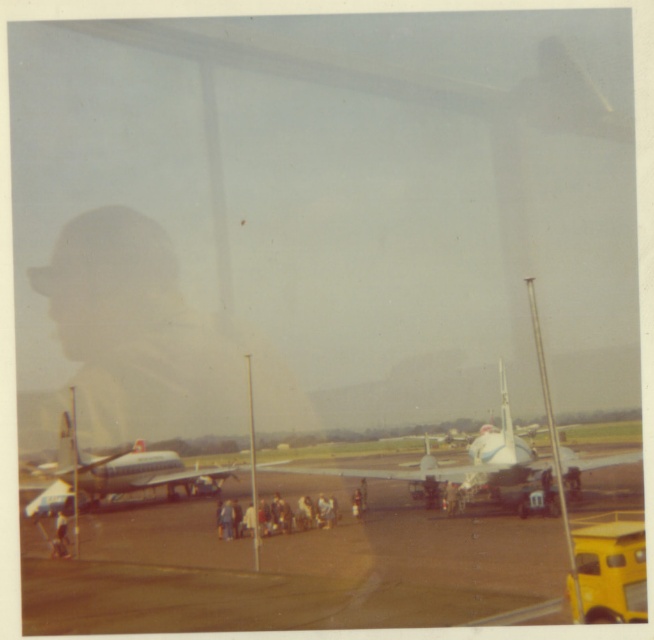
In the scene shown: You are a photographer standing at the edge of the airport tarmac. You want to capture a photo of the smooth asphalt tarmac at center and the light beige fabric person at lower left in the same frame. Based on their positions, which object is closer to you?

The light beige fabric person at lower left is closer to you because they are positioned at the lower left, which is typically closer in such scenes, while the smooth asphalt tarmac at center is further back.

You are standing at the point marked by the coordinates point (109, 474) in the image. What object are you directly facing?

You are directly facing the silver metallic airplane at center marked by the coordinates point (109, 474).